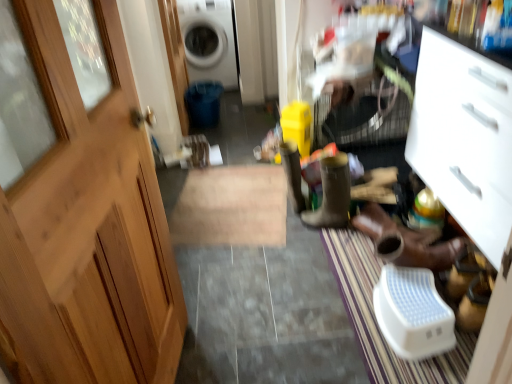
Identify the location of vacant space that is to the left of brown leather boot at center, which is counted as the second footwear, starting from the right. (293, 238).